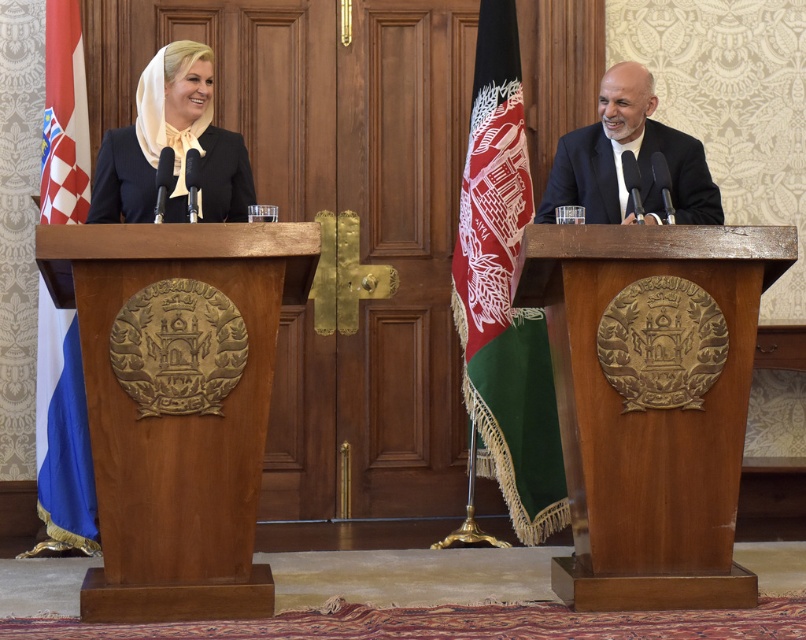
You are an event planner setting up for a diplomatic meeting. You need to place a white and blue fabric flag at left and a smooth black suit at right on a table. According to the scene, which object should be placed to the left of the other?

The white and blue fabric flag at left should be placed to the left of the smooth black suit at right because the white and blue fabric flag at left is positioned on the left side of smooth black suit at right in the scene.

You are a photographer positioned behind the wooden podium at center. You want to capture a photo of both individuals in the same frame. Given that your camera has a 50mm lens, which has a field of view of approximately 46 degrees, can you fit both individuals into the frame without moving closer or further away?

The wooden podiums are 13.16 feet apart. With a 50mm lens having a 46 degree field of view, the photographer can fit both individuals into the frame as the distance between them is within the lens capabilities.

From the picture: You are a photographer at a diplomatic event. You need to capture a photo where both the wooden podium at center and the white and blue fabric flag at left are visible. Given that your camera can only focus on objects within a 1.5 meter height range, will both objects fit within this range?

The wooden podium at center is taller than the white and blue fabric flag at left. Since the camera can focus on objects within a 1.5 meter height range, if the podium exceeds this height, the flag might still be within range, but the podium might not. However, without specific height measurements, it is uncertain. The description only states the podium is taller than the flag, but not their exact heights.